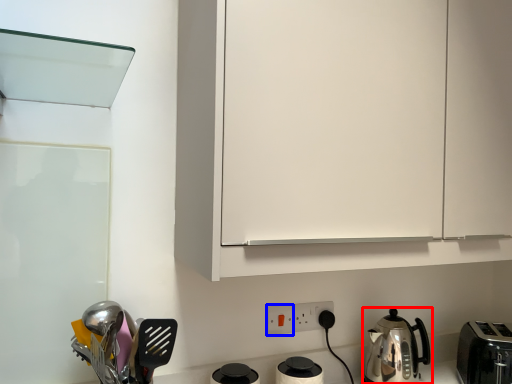
Question: Among these objects, which one is nearest to the camera, kitchen appliance (highlighted by a red box) or electric outlet (highlighted by a blue box)?

Choices:
 (A) kitchen appliance
 (B) electric outlet

Answer: (A)